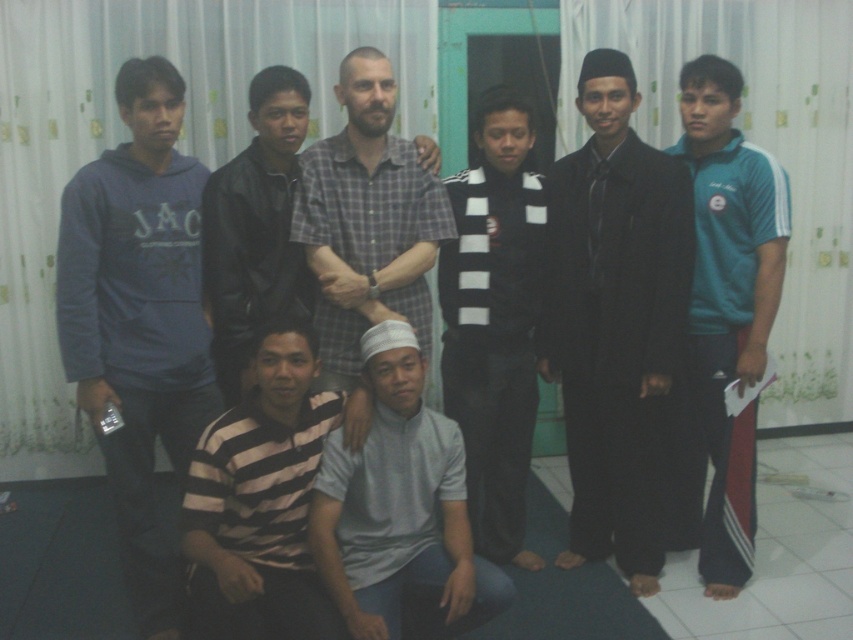
You are a photographer trying to adjust the lighting for a group photo. You notice the teal athletic wear at right and the gray matte shirt at center. Which clothing item is positioned higher in the frame?

The teal athletic wear at right is located above the gray matte shirt at center, so it is positioned higher in the frame.

In the photo, there are two people wearing teal athletic wear at right and gray matte shirt at center. Which one is positioned more to the right side of the image?

The teal athletic wear at right is positioned more to the right side of the image because it is to the right of the gray matte shirt at center.